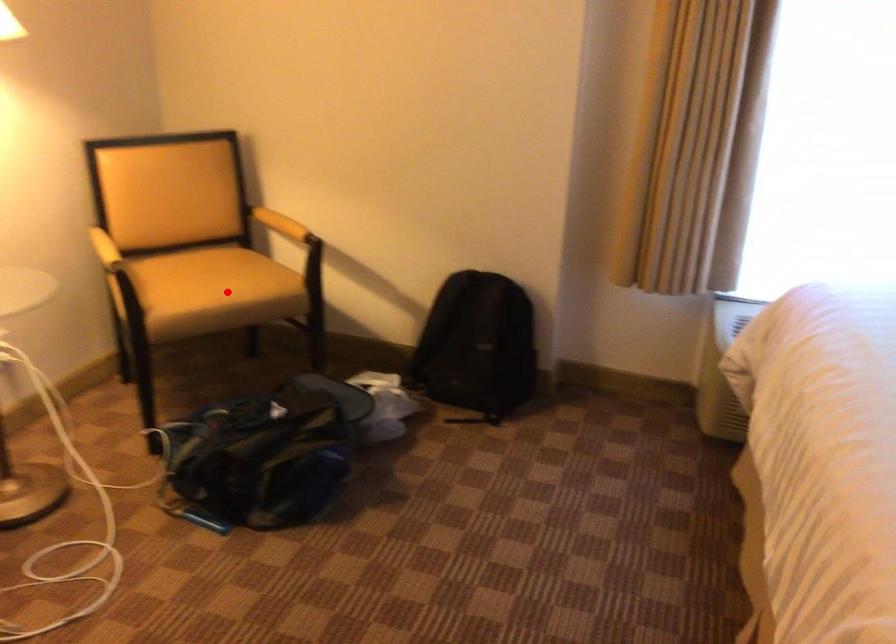
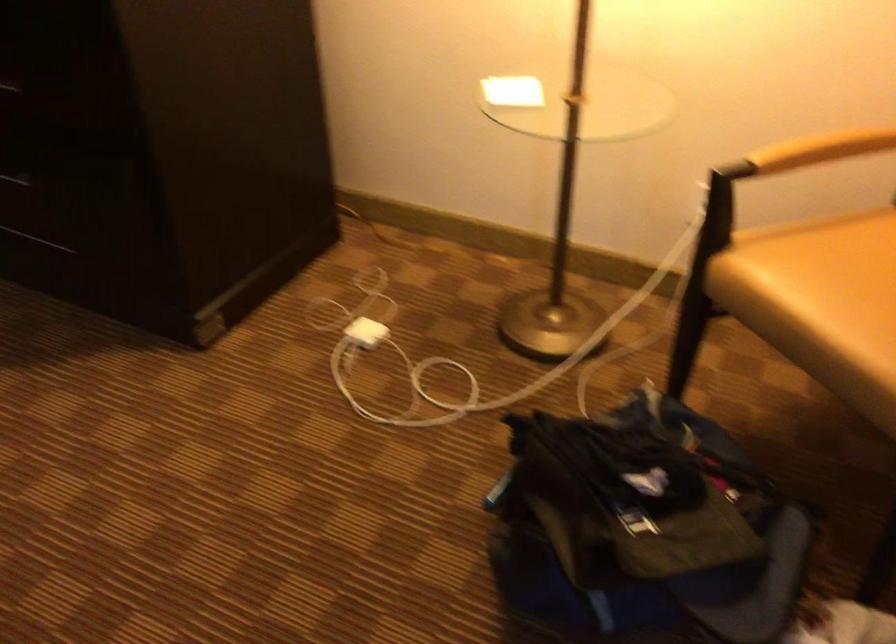
Question: I am providing you with two images of the same scene from different viewpoints. Image1 has a red point marked. In image2, the corresponding 3D location appears at what relative position? Reply with the corresponding letter.

Choices:
 (A) Closer
 (B) Farther

Answer: (A)